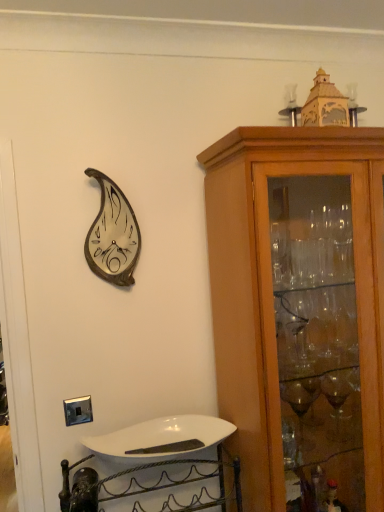
Question: Is white glossy sink at lower center situated inside light brown wood cabinet at right or outside?

Choices:
 (A) outside
 (B) inside

Answer: (A)

Question: Is white glossy sink at lower center wider or thinner than light brown wood cabinet at right?

Choices:
 (A) wide
 (B) thin

Answer: (B)

Question: Estimate the real-world distances between objects in this image. Which object is closer to the metallic silver clock at upper left?

Choices:
 (A) light brown wood cabinet at right
 (B) white glossy sink at lower center

Answer: (A)

Question: Estimate the real-world distances between objects in this image. Which object is closer to the white glossy sink at lower center?

Choices:
 (A) metallic silver clock at upper left
 (B) light brown wood cabinet at right

Answer: (B)